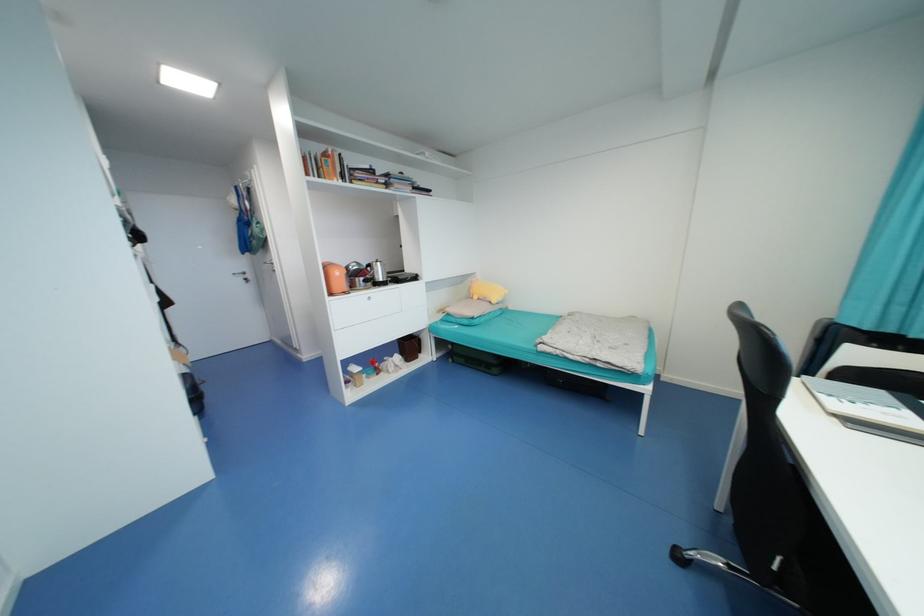
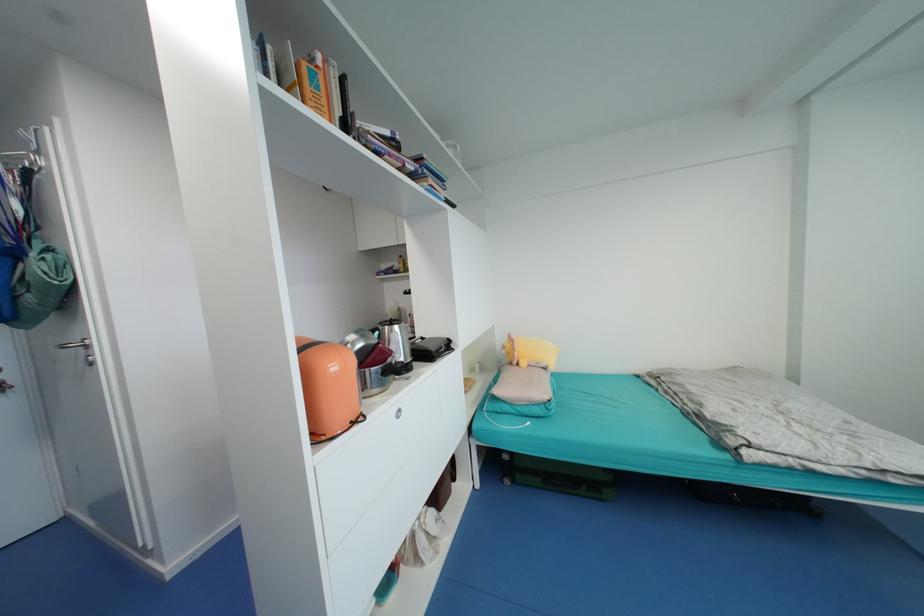
Which direction would the cameraman need to move to produce the second image?

The movement direction of the cameraman is left, forward.